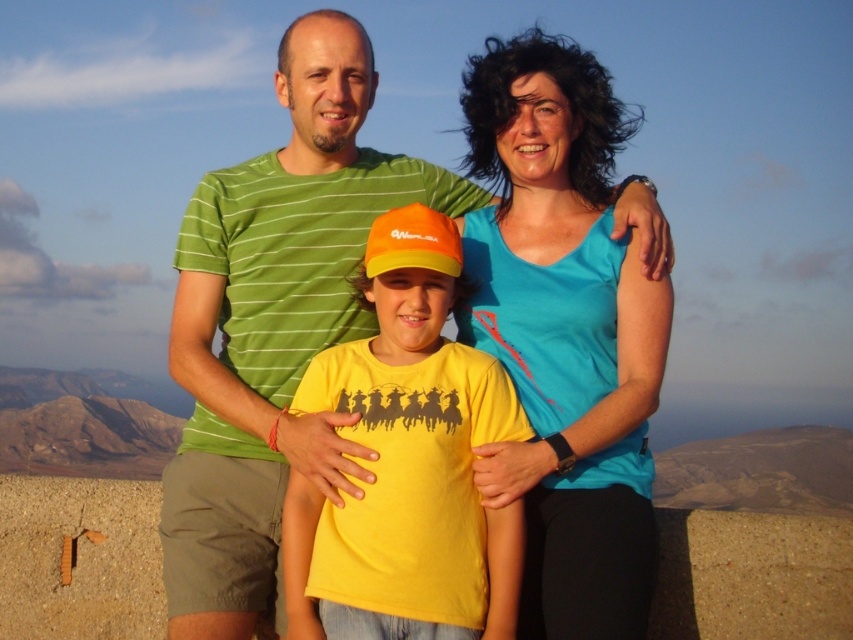
Based on the scene description, where is the green striped shirt at upper center located in the image?

The green striped shirt at upper center is located at point (x=274, y=323).

You are a photographer trying to capture a candid shot of the blue fabric tank top at upper center. Given its position at coordinates point 0.522, 0.662, where exactly should you aim your camera to ensure it is centered in the frame?

To center the blue fabric tank top at upper center at point (564, 333) in the frame, aim your camera directly at those coordinates.